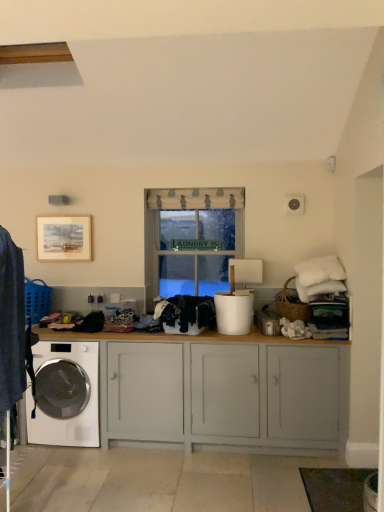
Question: From the image's perspective, is white fabric at center above white glossy washing machine at lower left?

Choices:
 (A) yes
 (B) no

Answer: (A)

Question: Is white fabric at center further to the viewer compared to white glossy washing machine at lower left?

Choices:
 (A) no
 (B) yes

Answer: (B)

Question: Can you confirm if white fabric at center is positioned to the right of white glossy washing machine at lower left?

Choices:
 (A) no
 (B) yes

Answer: (B)

Question: From a real-world perspective, is white fabric at center over white glossy washing machine at lower left?

Choices:
 (A) no
 (B) yes

Answer: (B)

Question: Are white fabric at center and white glossy washing machine at lower left far apart?

Choices:
 (A) yes
 (B) no

Answer: (A)

Question: Considering the relative sizes of white fabric at center and white glossy washing machine at lower left in the image provided, is white fabric at center thinner than white glossy washing machine at lower left?

Choices:
 (A) no
 (B) yes

Answer: (B)

Question: Is white glossy washing machine at lower left at the right side of black cotton clothes at center, which appears as the first clothing when viewed from the right?

Choices:
 (A) yes
 (B) no

Answer: (B)

Question: Does white glossy washing machine at lower left have a smaller size compared to black cotton clothes at center, which is the first clothing from back to front?

Choices:
 (A) yes
 (B) no

Answer: (B)

Question: Is white glossy washing machine at lower left in front of black cotton clothes at center, which appears as the first clothing when viewed from the right?

Choices:
 (A) yes
 (B) no

Answer: (B)

Question: Are white glossy washing machine at lower left and black cotton clothes at center, which appears as the first clothing when viewed from the right, located far from each other?

Choices:
 (A) yes
 (B) no

Answer: (B)

Question: Considering the relative positions of white glossy washing machine at lower left and black cotton clothes at center, which appears as the first clothing when viewed from the right, in the image provided, is white glossy washing machine at lower left behind black cotton clothes at center, which appears as the first clothing when viewed from the right,?

Choices:
 (A) yes
 (B) no

Answer: (A)

Question: Is white glossy washing machine at lower left surrounding black cotton clothes at center, the 2th clothing from the front?

Choices:
 (A) no
 (B) yes

Answer: (A)

Question: Considering the relative sizes of white painted wood cabinet at center and white fabric at center in the image provided, is white painted wood cabinet at center shorter than white fabric at center?

Choices:
 (A) no
 (B) yes

Answer: (B)